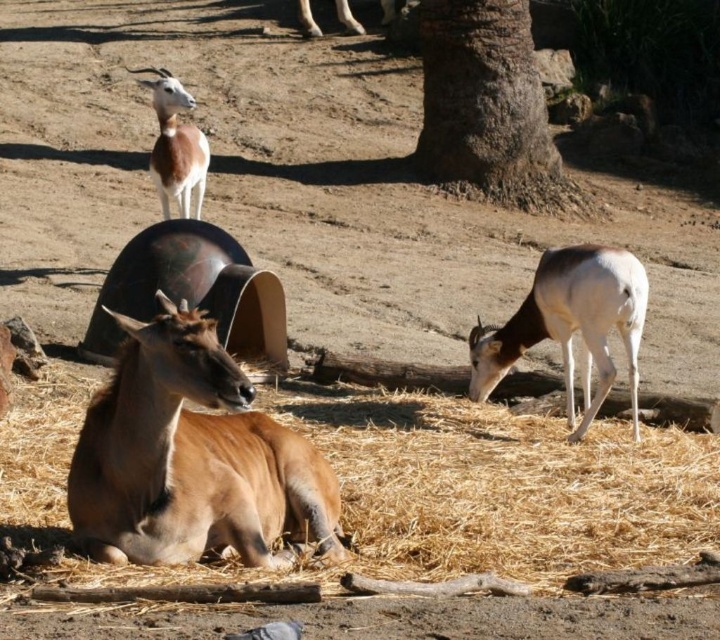
Between brown matte/deer at center and white glossy antelope at lower right, which one has less height?

brown matte/deer at center

Which is below, brown matte/deer at center or white glossy antelope at lower right?

brown matte/deer at center

In order to click on brown matte/deer at center in this screenshot , I will do `click(192, 458)`.

Is point (487, 488) farther from camera compared to point (174, 84)?

No, it is in front of (174, 84).

Does brown dry hay at lower center have a smaller size compared to light brown fur antelope at upper left?

Actually, brown dry hay at lower center might be larger than light brown fur antelope at upper left.

Who is more forward, (647, 547) or (186, 125)?

Point (647, 547) is more forward.

At what (x,y) coordinates should I click in order to perform the action: click on brown dry hay at lower center. Please return your answer as a coordinate pair (x, y). Looking at the image, I should click on tap(505, 486).

Is white glossy antelope at lower right taller than light brown fur antelope at upper left?

Indeed, white glossy antelope at lower right has a greater height compared to light brown fur antelope at upper left.

From the picture: Is white glossy antelope at lower right to the right of light brown fur antelope at upper left from the viewer's perspective?

Yes, white glossy antelope at lower right is to the right of light brown fur antelope at upper left.

Is point (575, 317) behind point (194, 180)?

No, it is in front of (194, 180).

Image resolution: width=720 pixels, height=640 pixels. I want to click on white glossy antelope at lower right, so click(570, 324).